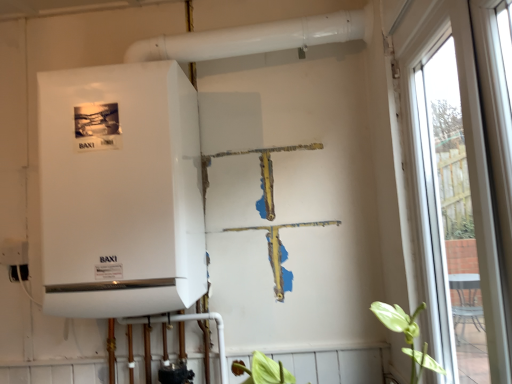
Question: Relative to white glossy boiler at left, is transparent glass window at right in front or behind?

Choices:
 (A) front
 (B) behind

Answer: (A)

Question: Considering the positions of transparent glass window at right and white glossy boiler at left in the image, is transparent glass window at right bigger or smaller than white glossy boiler at left?

Choices:
 (A) big
 (B) small

Answer: (B)

Question: Is transparent glass window at right wider or thinner than white glossy boiler at left?

Choices:
 (A) wide
 (B) thin

Answer: (B)

Question: Is white glossy boiler at left inside or outside of transparent glass window at right?

Choices:
 (A) outside
 (B) inside

Answer: (A)

Question: Considering the positions of white glossy boiler at left and transparent glass window at right in the image, is white glossy boiler at left wider or thinner than transparent glass window at right?

Choices:
 (A) wide
 (B) thin

Answer: (A)

Question: Based on their positions, is white glossy boiler at left located to the left or right of transparent glass window at right?

Choices:
 (A) right
 (B) left

Answer: (B)

Question: Considering the positions of white glossy boiler at left and transparent glass window at right in the image, is white glossy boiler at left taller or shorter than transparent glass window at right?

Choices:
 (A) tall
 (B) short

Answer: (B)